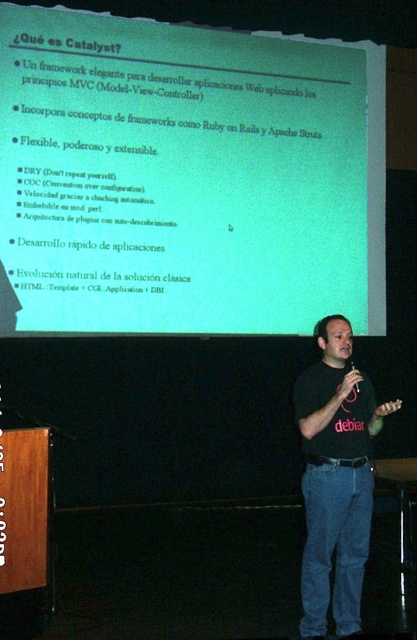
Between green matte projector screen at upper center and black cotton shirt at center, which one appears on the left side from the viewer's perspective?

green matte projector screen at upper center

Does green matte projector screen at upper center appear over black cotton shirt at center?

Yes, green matte projector screen at upper center is above black cotton shirt at center.

Does point (75, 92) come closer to viewer compared to point (309, 456)?

No, it is not.

Find the location of a particular element. The height and width of the screenshot is (640, 417). green matte projector screen at upper center is located at coordinates 188,177.